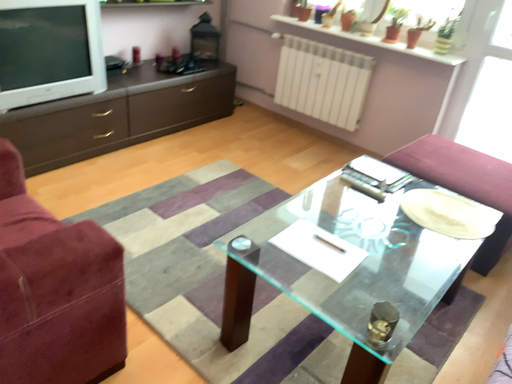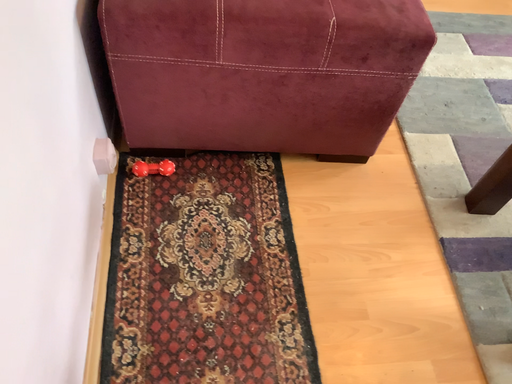
Question: Which way did the camera rotate in the video?

Choices:
 (A) rotated downward
 (B) rotated upward

Answer: (A)